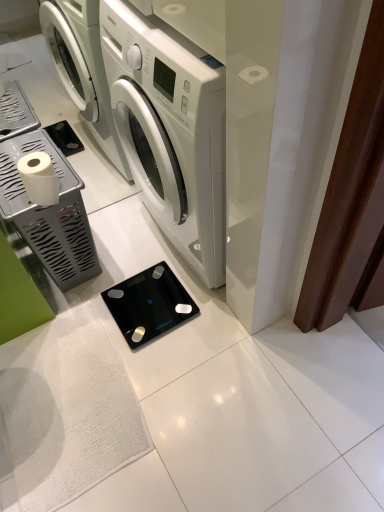
Question: Considering the positions of silver metallic toilet paper holder at left, placed as the 1th appliance when sorted from left to right, and black glass scale at center, the 2th appliance from the left, in the image, is silver metallic toilet paper holder at left, placed as the 1th appliance when sorted from left to right, taller or shorter than black glass scale at center, the 2th appliance from the left,?

Choices:
 (A) tall
 (B) short

Answer: (A)

Question: In terms of width, does silver metallic toilet paper holder at left, placed as the 1th appliance when sorted from left to right, look wider or thinner when compared to black glass scale at center, the 2th appliance from the left?

Choices:
 (A) wide
 (B) thin

Answer: (B)

Question: Considering the real-world distances, which object is farthest from the white matte toilet paper at left?

Choices:
 (A) black glass scale at center, acting as the first appliance starting from the right
 (B) white glossy washing machine at center
 (C) silver metallic toilet paper holder at left, which is counted as the 2th appliance, starting from the right

Answer: (A)

Question: Which object is positioned closest to the black glass scale at center, acting as the first appliance starting from the right?

Choices:
 (A) white glossy washing machine at center
 (B) white matte toilet paper at left
 (C) silver metallic toilet paper holder at left, placed as the 1th appliance when sorted from left to right

Answer: (C)